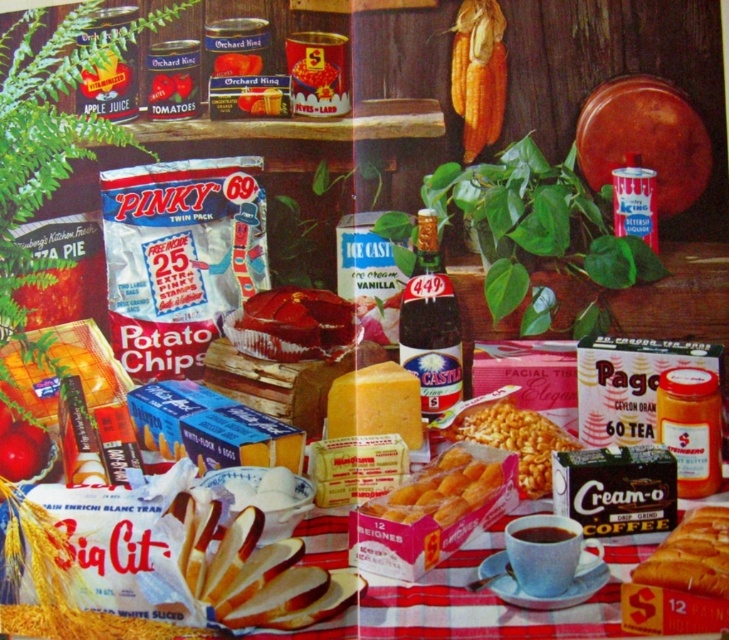
You are taking a photo of the grocery items on the table. You notice two points marked on the image at coordinates point (428, 296) and point (687, 545). Which point is closer to the camera?

Point (428, 296) is further to the camera than point (687, 545), so the point closer to the camera is point (687, 545).

You are organizing groceries on a table and need to place a new item between the brown glass bottle at center and the shiny red jelly at center. Based on their positions, where should you place the new item?

The brown glass bottle at center is located above the shiny red jelly at center, so placing the new item between them would require positioning it below the brown glass bottle at center and above the shiny red jelly at center.